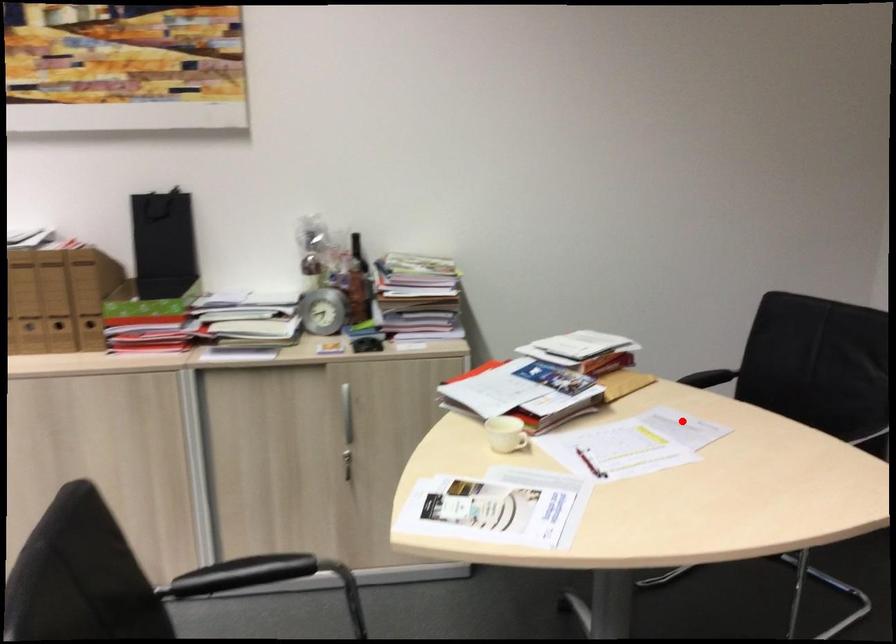
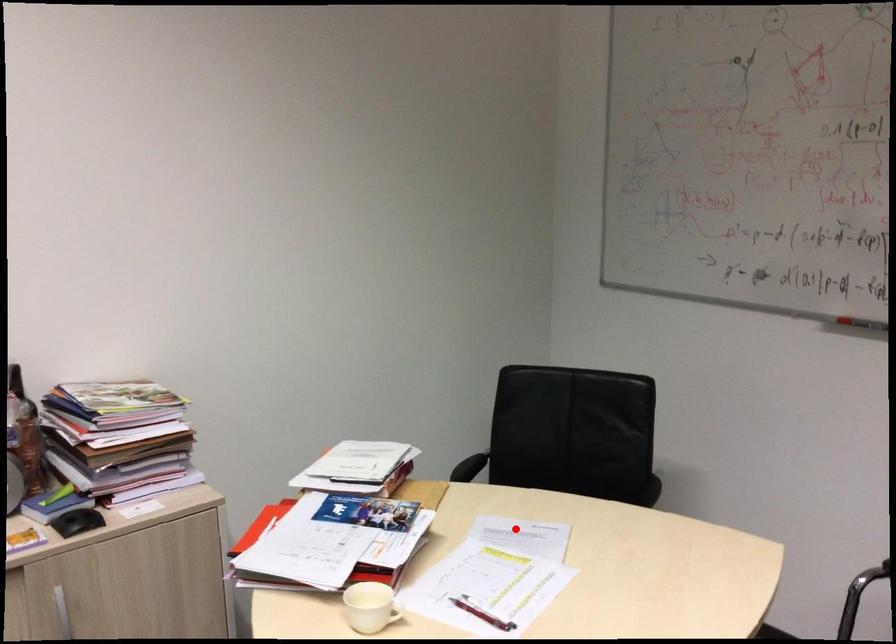
I am providing you with two images of the same scene from different viewpoints. A red point is marked on the first image and another point is marked on the second image. Do the highlighted points in image1 and image2 indicate the same real-world spot?

Yes